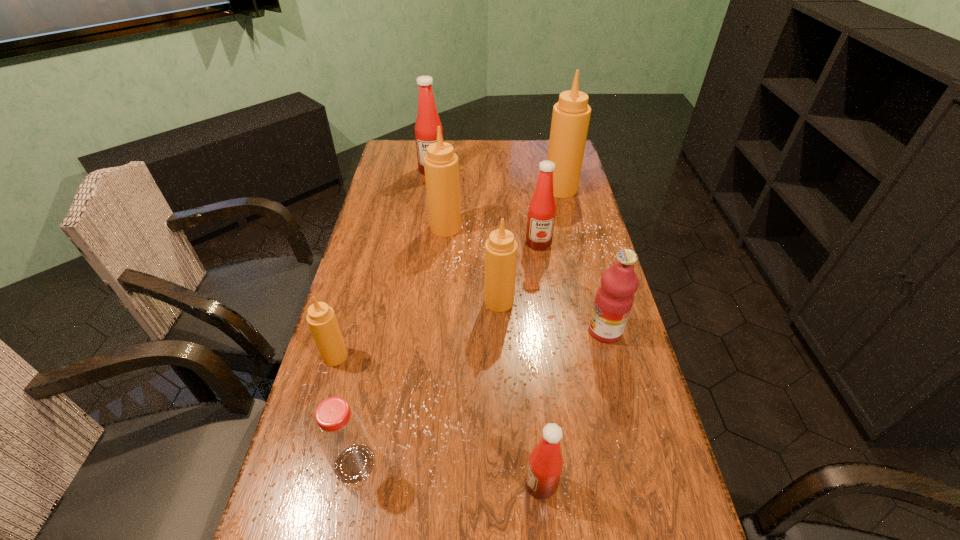
Locate an element on the screen. This screenshot has width=960, height=540. free space between the fruit juice and the second farthest red condiment is located at coordinates (571, 287).

Where is `free space between the rightmost tan condiment and the red bottle`? The image size is (960, 540). free space between the rightmost tan condiment and the red bottle is located at coordinates (458, 326).

Where is `free area in between the third nearest tan condiment and the eighth nearest object`? free area in between the third nearest tan condiment and the eighth nearest object is located at coordinates (503, 208).

At what (x,y) coordinates should I click in order to perform the action: click on object that ranks as the seventh closest to the farthest condiment. Please return your answer as a coordinate pair (x, y). The width and height of the screenshot is (960, 540). Looking at the image, I should click on (342, 436).

Where is `object identified as the fourth closest to the second farthest red condiment`? Image resolution: width=960 pixels, height=540 pixels. object identified as the fourth closest to the second farthest red condiment is located at coordinates (614, 299).

Where is `condiment that stands as the fifth closest to the sixth farthest condiment`? This screenshot has width=960, height=540. condiment that stands as the fifth closest to the sixth farthest condiment is located at coordinates (427, 122).

The height and width of the screenshot is (540, 960). Identify the location of condiment that stands as the fourth closest to the second nearest tan condiment. (545, 465).

This screenshot has width=960, height=540. I want to click on the third closest tan condiment to the fifth farthest condiment, so click(571, 114).

Point out which tan condiment is positioned as the fourth nearest to the bottle. Please provide its 2D coordinates. Your answer should be formatted as a tuple, i.e. [(x, y)], where the tuple contains the x and y coordinates of a point satisfying the conditions above.

[(571, 114)]

Identify which red condiment is the second nearest to the nearest red condiment. Please provide its 2D coordinates. Your answer should be formatted as a tuple, i.e. [(x, y)], where the tuple contains the x and y coordinates of a point satisfying the conditions above.

[(427, 122)]